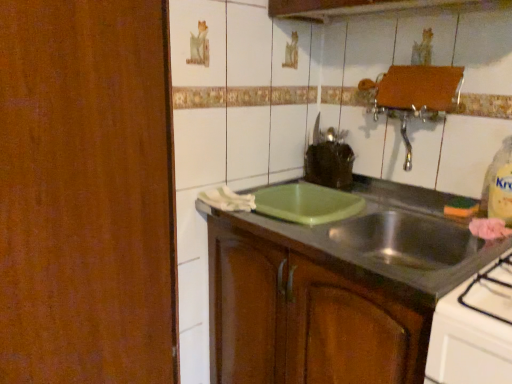
I want to click on free spot above green matte cutting board at center (from a real-world perspective), so click(355, 215).